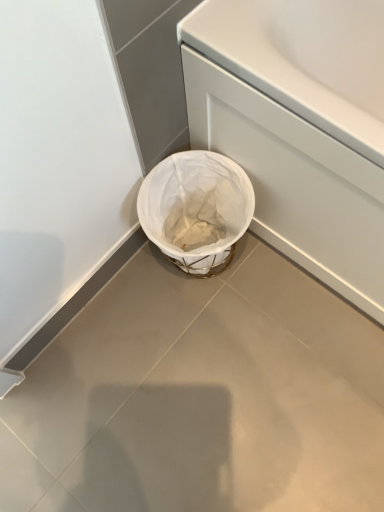
Find the location of a particular element. This screenshot has height=512, width=384. empty space that is to the right of white fabric basket at lower center is located at coordinates (277, 279).